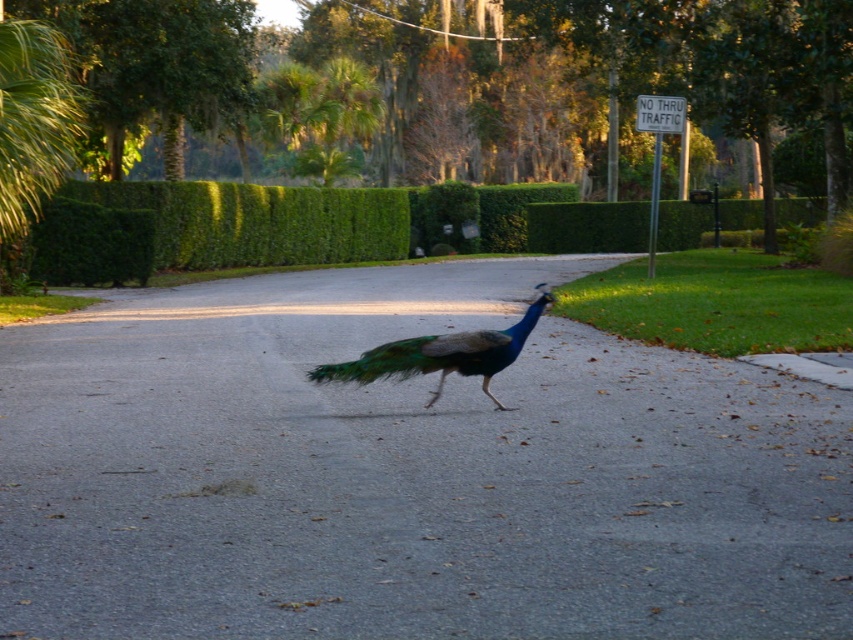
You are a delivery drone flying over a suburban area. You need to land on the shiny asphalt road at center. What are the coordinates where you should land?

The coordinates for the shiny asphalt road at center are at point (407, 472).

You are a delivery drone flying over a suburban area and need to land on the paved road. The coordinates for the landing zone are given as point (309, 225). Based on the scene description, what is located at those coordinates?

The coordinates point (309, 225) are on the green leafy hedge at center, so the landing zone is not on the paved road but on the hedge.

You are a photographer trying to capture the peacock in the image. The shiny blue peacock at center and the green iridescent tail at center are both in your viewfinder. Which part of the peacock is positioned lower in the image?

The shiny blue peacock at center is located below the green iridescent tail at center, so the shiny blue peacock at center is positioned lower in the image.